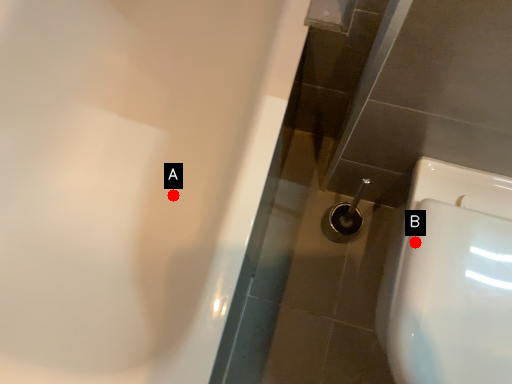
Question: Two points are circled on the image, labeled by A and B beside each circle. Which point is closer to the camera?

Choices:
 (A) A is closer
 (B) B is closer

Answer: (B)